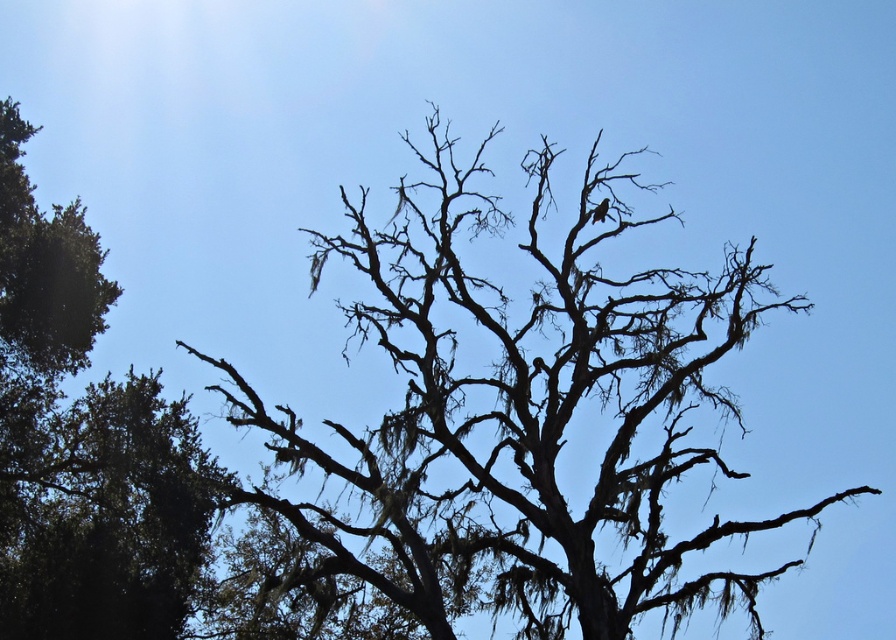
Can you confirm if silhouette bark tree at center is taller than green leafy tree at left?

Correct, silhouette bark tree at center is much taller as green leafy tree at left.

Does silhouette bark tree at center appear over green leafy tree at left?

No, silhouette bark tree at center is not above green leafy tree at left.

Between point (636, 520) and point (183, 400), which one is positioned in front?

Point (636, 520) is in front.

Identify the location of silhouette bark tree at center. (521, 416).